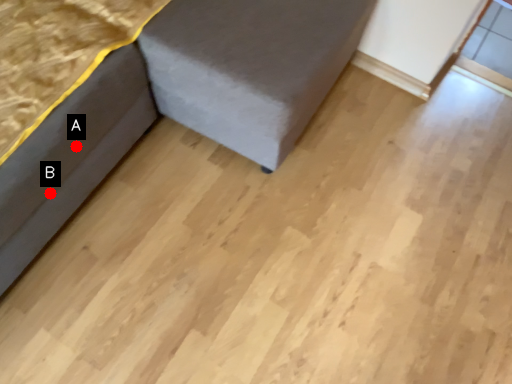
Question: Two points are circled on the image, labeled by A and B beside each circle. Which of the following is the closest to the observer?

Choices:
 (A) A is closer
 (B) B is closer

Answer: (B)